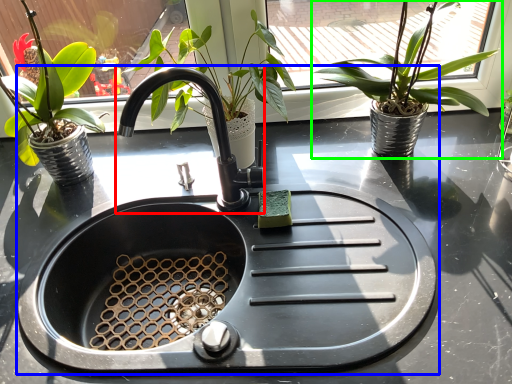
Question: Estimate the real-world distances between objects in this image. Which object is closer to tap (highlighted by a red box), sink (highlighted by a blue box) or houseplant (highlighted by a green box)?

Choices:
 (A) sink
 (B) houseplant

Answer: (A)